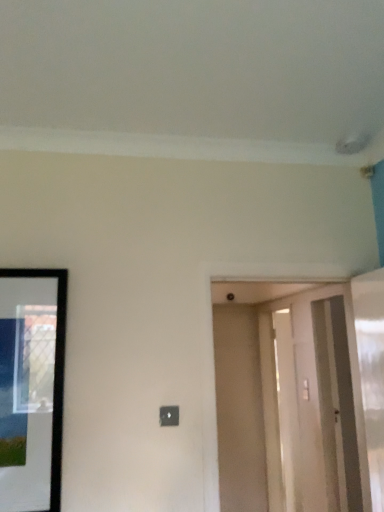
What is the approximate width of black glossy picture frame at left?

black glossy picture frame at left is 2.16 inches in width.

The height and width of the screenshot is (512, 384). I want to click on smooth beige door at center, so click(x=239, y=410).

What do you see at coordinates (239, 410) in the screenshot? I see `smooth beige door at center` at bounding box center [239, 410].

Identify the location of black glossy picture frame at left. The height and width of the screenshot is (512, 384). (31, 388).

From the image's perspective, which object appears higher, black glossy picture frame at left or clear glass screen door at right?

From the image's view, black glossy picture frame at left is above.

Locate an element on the screen. This screenshot has width=384, height=512. picture frame located above the clear glass screen door at right (from the image's perspective) is located at coordinates click(x=31, y=388).

Is black glossy picture frame at left positioned far away from clear glass screen door at right?

Yes.

Considering the points (15, 422) and (335, 376), which point is in front, point (15, 422) or point (335, 376)?

Positioned in front is point (15, 422).

Between smooth beige door at center and black glossy picture frame at left, which one has smaller size?

Smaller between the two is black glossy picture frame at left.

Is smooth beige door at center taller or shorter than black glossy picture frame at left?

Clearly, smooth beige door at center is taller compared to black glossy picture frame at left.

From the image's perspective, which object appears higher, smooth beige door at center or black glossy picture frame at left?

black glossy picture frame at left is shown above in the image.

Considering the relative positions of black glossy picture frame at left and smooth beige door at center in the image provided, is black glossy picture frame at left to the right of smooth beige door at center from the viewer's perspective?

No.

Relative to smooth beige door at center, is black glossy picture frame at left in front or behind?

black glossy picture frame at left is in front of smooth beige door at center.

Are black glossy picture frame at left and smooth beige door at center beside each other?

No, black glossy picture frame at left is not beside smooth beige door at center.

Consider the image. Considering the relative positions of smooth beige door at center and clear glass screen door at right in the image provided, is smooth beige door at center to the left of clear glass screen door at right from the viewer's perspective?

Correct, you'll find smooth beige door at center to the left of clear glass screen door at right.

Can you see smooth beige door at center touching clear glass screen door at right?

No, smooth beige door at center is not next to clear glass screen door at right.

From a real-world perspective, is smooth beige door at center on clear glass screen door at right?

Actually, smooth beige door at center is physically below clear glass screen door at right in the real world.

Is smooth beige door at center thinner than clear glass screen door at right?

Yes.

Considering their positions, is clear glass screen door at right located in front of or behind black glossy picture frame at left?

clear glass screen door at right is behind black glossy picture frame at left.

Find the location of `picture frame to the left of clear glass screen door at right`. picture frame to the left of clear glass screen door at right is located at coordinates (31, 388).

Can you tell me how much clear glass screen door at right and black glossy picture frame at left differ in facing direction?

The angular difference between clear glass screen door at right and black glossy picture frame at left is 89.5 degrees.

In the scene shown: Considering the relative sizes of clear glass screen door at right and black glossy picture frame at left in the image provided, is clear glass screen door at right thinner than black glossy picture frame at left?

In fact, clear glass screen door at right might be wider than black glossy picture frame at left.

Can you tell me how much clear glass screen door at right and smooth beige door at center differ in facing direction?

The facing directions of clear glass screen door at right and smooth beige door at center are 89.1 degrees apart.

Considering the positions of objects clear glass screen door at right and smooth beige door at center in the image provided, who is in front, clear glass screen door at right or smooth beige door at center?

clear glass screen door at right.

Is clear glass screen door at right not near smooth beige door at center?

That's right, there is a large distance between clear glass screen door at right and smooth beige door at center.

Which object is positioned more to the left, clear glass screen door at right or smooth beige door at center?

smooth beige door at center is more to the left.

Locate an element on the screen. The width and height of the screenshot is (384, 512). picture frame in front of the clear glass screen door at right is located at coordinates (31, 388).

In order to click on door on the right of black glossy picture frame at left in this screenshot , I will do `click(239, 410)`.

Looking at the image, which one is located further to smooth beige door at center, black glossy picture frame at left or clear glass screen door at right?

black glossy picture frame at left lies further to smooth beige door at center than the other object.

Which object lies further to the anchor point black glossy picture frame at left, smooth beige door at center or clear glass screen door at right?

smooth beige door at center.

Estimate the real-world distances between objects in this image. Which object is further from clear glass screen door at right, smooth beige door at center or black glossy picture frame at left?

Based on the image, black glossy picture frame at left appears to be further to clear glass screen door at right.

Considering their positions, is black glossy picture frame at left positioned further to clear glass screen door at right than smooth beige door at center?

black glossy picture frame at left is further to clear glass screen door at right.

From the picture: From the image, which object appears to be farther from smooth beige door at center, clear glass screen door at right or black glossy picture frame at left?

Among the two, black glossy picture frame at left is located further to smooth beige door at center.

Estimate the real-world distances between objects in this image. Which object is further from black glossy picture frame at left, clear glass screen door at right or smooth beige door at center?

smooth beige door at center lies further to black glossy picture frame at left than the other object.

Identify the location of screen door located between black glossy picture frame at left and smooth beige door at center in the depth direction. (336, 405).